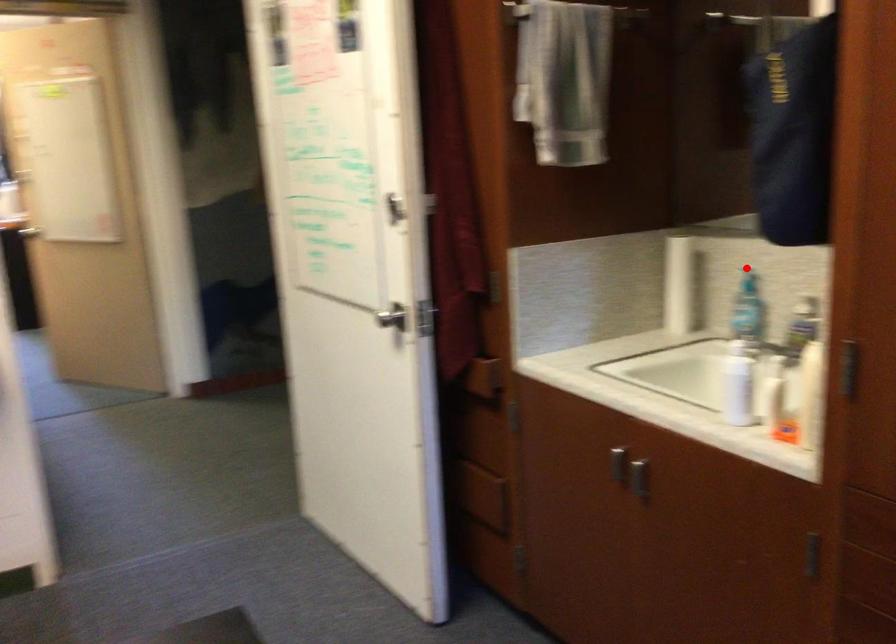
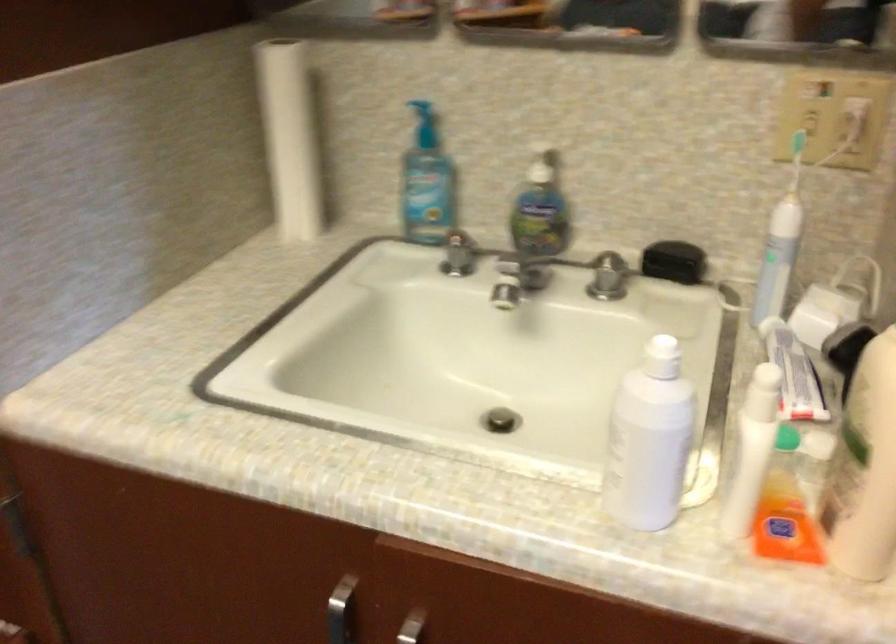
The point at the highlighted location is marked in the first image. Where is the corresponding point in the second image?

(423, 109)